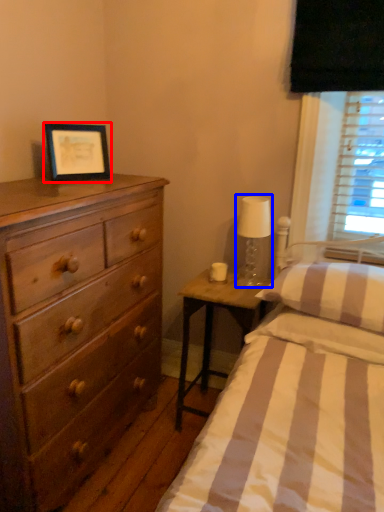
Question: Which object is closer to the camera taking this photo, picture frame (highlighted by a red box) or bedside lamp (highlighted by a blue box)?

Choices:
 (A) picture frame
 (B) bedside lamp

Answer: (A)